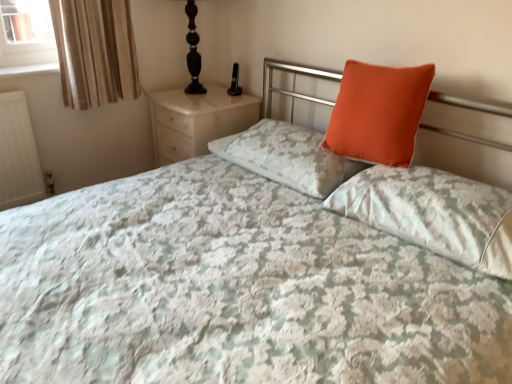
Measure the distance between beige striped fabric at upper left and camera.

beige striped fabric at upper left is 2.02 meters from camera.

Locate an element on the screen. beige striped fabric at upper left is located at coordinates (95, 51).

The image size is (512, 384). Describe the element at coordinates (288, 157) in the screenshot. I see `orange fabric pillow at center, which is the 3th pillow from right to left` at that location.

Image resolution: width=512 pixels, height=384 pixels. Describe the element at coordinates (197, 120) in the screenshot. I see `white marble nightstand at upper left` at that location.

The width and height of the screenshot is (512, 384). Find the location of `orange matte pillow at upper right, which appears as the 2th pillow when viewed from the right`. orange matte pillow at upper right, which appears as the 2th pillow when viewed from the right is located at coordinates (378, 113).

What do you see at coordinates (193, 51) in the screenshot? I see `black glass table lamp at upper left` at bounding box center [193, 51].

This screenshot has height=384, width=512. What are the coordinates of `beige striped fabric at upper left` in the screenshot? It's located at (95, 51).

Considering the relative sizes of beige striped fabric at upper left and orange fabric pillow at center, which is counted as the first pillow, starting from the left, in the image provided, is beige striped fabric at upper left smaller than orange fabric pillow at center, which is counted as the first pillow, starting from the left,?

Indeed, beige striped fabric at upper left has a smaller size compared to orange fabric pillow at center, which is counted as the first pillow, starting from the left.

Is beige striped fabric at upper left facing towards orange fabric pillow at center, which is counted as the first pillow, starting from the left?

Yes, beige striped fabric at upper left is aimed at orange fabric pillow at center, which is counted as the first pillow, starting from the left.

Considering the positions of objects beige striped fabric at upper left and orange fabric pillow at center, which is counted as the first pillow, starting from the left, in the image provided, who is more to the left, beige striped fabric at upper left or orange fabric pillow at center, which is counted as the first pillow, starting from the left,?

beige striped fabric at upper left.

At what (x,y) coordinates should I click in order to perform the action: click on pillow that is the 1st object located in front of the beige striped fabric at upper left. Please return your answer as a coordinate pair (x, y). This screenshot has height=384, width=512. Looking at the image, I should click on (288, 157).

Does white marble nightstand at upper left have a lesser width compared to beige striped fabric at upper left?

Incorrect, the width of white marble nightstand at upper left is not less than that of beige striped fabric at upper left.

Can you tell me how much white marble nightstand at upper left and beige striped fabric at upper left differ in facing direction?

90.1 degrees.

Which of these two, white marble nightstand at upper left or beige striped fabric at upper left, is bigger?

Bigger between the two is white marble nightstand at upper left.

Is orange fabric pillow at center, which is counted as the first pillow, starting from the left, situated inside orange matte pillow at upper right, which appears as the 2th pillow when viewed from the right, or outside?

The correct answer is: outside.

Considering the sizes of objects orange fabric pillow at center, which is the 3th pillow from right to left, and orange matte pillow at upper right, the second pillow in the left-to-right sequence, in the image provided, who is bigger, orange fabric pillow at center, which is the 3th pillow from right to left, or orange matte pillow at upper right, the second pillow in the left-to-right sequence,?

orange fabric pillow at center, which is the 3th pillow from right to left.

From a real-world perspective, which pillow is the 2nd one above the orange fabric pillow at center, which is counted as the first pillow, starting from the left? Please provide its 2D coordinates.

[(378, 113)]

In the scene shown: Can you see orange fabric pillow at center, which is the 3th pillow from right to left, touching orange matte pillow at upper right, which appears as the 2th pillow when viewed from the right?

orange fabric pillow at center, which is the 3th pillow from right to left, is not next to orange matte pillow at upper right, which appears as the 2th pillow when viewed from the right, and they're not touching.

Considering the sizes of white marble nightstand at upper left and orange fabric pillow at upper right, the 1th pillow viewed from the right, in the image, is white marble nightstand at upper left taller or shorter than orange fabric pillow at upper right, the 1th pillow viewed from the right,?

white marble nightstand at upper left is taller than orange fabric pillow at upper right, the 1th pillow viewed from the right.

Based on the photo, is white marble nightstand at upper left next to orange fabric pillow at upper right, the 3th pillow when ordered from left to right, and touching it?

There is a gap between white marble nightstand at upper left and orange fabric pillow at upper right, the 3th pillow when ordered from left to right.

Is white marble nightstand at upper left positioned with its back to orange fabric pillow at upper right, the 3th pillow when ordered from left to right?

white marble nightstand at upper left is not turned away from orange fabric pillow at upper right, the 3th pillow when ordered from left to right.

Consider the image. Can you tell me how much white marble nightstand at upper left and orange fabric pillow at upper right, the 3th pillow when ordered from left to right, differ in facing direction?

1.63 degrees separate the facing orientations of white marble nightstand at upper left and orange fabric pillow at upper right, the 3th pillow when ordered from left to right.

Where is `table lamp above the orange fabric pillow at upper right, the 3th pillow when ordered from left to right (from the image's perspective)`? The image size is (512, 384). table lamp above the orange fabric pillow at upper right, the 3th pillow when ordered from left to right (from the image's perspective) is located at coordinates (193, 51).

From the image's perspective, is black glass table lamp at upper left positioned above or below orange fabric pillow at upper right, the 3th pillow when ordered from left to right?

black glass table lamp at upper left is above orange fabric pillow at upper right, the 3th pillow when ordered from left to right.

What's the angular difference between black glass table lamp at upper left and orange fabric pillow at upper right, the 3th pillow when ordered from left to right,'s facing directions?

There is a 1.68-degree angle between the facing directions of black glass table lamp at upper left and orange fabric pillow at upper right, the 3th pillow when ordered from left to right.

Which object is closer to the camera taking this photo, black glass table lamp at upper left or orange fabric pillow at upper right, the 1th pillow viewed from the right?

orange fabric pillow at upper right, the 1th pillow viewed from the right, is in front.

Is orange matte pillow at upper right, which appears as the 2th pillow when viewed from the right, aimed at beige striped fabric at upper left?

No, orange matte pillow at upper right, which appears as the 2th pillow when viewed from the right, is not aimed at beige striped fabric at upper left.

What's the angular difference between orange matte pillow at upper right, the second pillow in the left-to-right sequence, and beige striped fabric at upper left's facing directions?

The angle between the facing direction of orange matte pillow at upper right, the second pillow in the left-to-right sequence, and the facing direction of beige striped fabric at upper left is 87.5 degrees.

Could you measure the distance between orange matte pillow at upper right, the second pillow in the left-to-right sequence, and beige striped fabric at upper left?

orange matte pillow at upper right, the second pillow in the left-to-right sequence, and beige striped fabric at upper left are 1.38 meters apart.

Which is closer to the camera, [413,70] or [119,54]?

Point [413,70] is closer to the camera than point [119,54].

Is orange matte pillow at upper right, the second pillow in the left-to-right sequence, located outside black glass table lamp at upper left?

Absolutely, orange matte pillow at upper right, the second pillow in the left-to-right sequence, is external to black glass table lamp at upper left.

Which object is more forward, orange matte pillow at upper right, which appears as the 2th pillow when viewed from the right, or black glass table lamp at upper left?

orange matte pillow at upper right, which appears as the 2th pillow when viewed from the right, is more forward.

Is orange matte pillow at upper right, which appears as the 2th pillow when viewed from the right, facing towards black glass table lamp at upper left?

No.

What's the angular difference between orange matte pillow at upper right, the second pillow in the left-to-right sequence, and black glass table lamp at upper left's facing directions?

The angular difference between orange matte pillow at upper right, the second pillow in the left-to-right sequence, and black glass table lamp at upper left is 2.64 degrees.

I want to click on curtain above the orange fabric pillow at center, which is counted as the first pillow, starting from the left (from a real-world perspective), so click(x=95, y=51).

You are a GUI agent. You are given a task and a screenshot of the screen. Output one action in this format:
    pyautogui.click(x=<x>, y=<y>)
    Task: Click on the nightstand that appears on the right of beige striped fabric at upper left
    The width and height of the screenshot is (512, 384).
    Given the screenshot: What is the action you would take?
    pyautogui.click(x=197, y=120)

Estimate the real-world distances between objects in this image. Which object is closer to orange matte pillow at upper right, the second pillow in the left-to-right sequence, white marble nightstand at upper left or orange fabric pillow at upper right, the 3th pillow when ordered from left to right?

orange fabric pillow at upper right, the 3th pillow when ordered from left to right.

From the image, which object appears to be nearer to black glass table lamp at upper left, orange fabric pillow at center, which is the 3th pillow from right to left, or white marble nightstand at upper left?

Among the two, white marble nightstand at upper left is located nearer to black glass table lamp at upper left.

When comparing their distances from black glass table lamp at upper left, does orange matte pillow at upper right, which appears as the 2th pillow when viewed from the right, or orange fabric pillow at center, which is counted as the first pillow, starting from the left, seem further?

orange matte pillow at upper right, which appears as the 2th pillow when viewed from the right, lies further to black glass table lamp at upper left than the other object.

Which object lies further to the anchor point beige striped fabric at upper left, black glass table lamp at upper left or orange matte pillow at upper right, the second pillow in the left-to-right sequence?

orange matte pillow at upper right, the second pillow in the left-to-right sequence, lies further to beige striped fabric at upper left than the other object.

Looking at this image, considering their positions, is white marble nightstand at upper left positioned closer to orange fabric pillow at upper right, the 3th pillow when ordered from left to right, than orange fabric pillow at center, which is the 3th pillow from right to left?

orange fabric pillow at center, which is the 3th pillow from right to left.

Based on their spatial positions, is black glass table lamp at upper left or orange fabric pillow at upper right, the 3th pillow when ordered from left to right, closer to orange matte pillow at upper right, which appears as the 2th pillow when viewed from the right?

orange fabric pillow at upper right, the 3th pillow when ordered from left to right, is closer to orange matte pillow at upper right, which appears as the 2th pillow when viewed from the right.

Based on their spatial positions, is beige striped fabric at upper left or orange matte pillow at upper right, which appears as the 2th pillow when viewed from the right, closer to white marble nightstand at upper left?

beige striped fabric at upper left is closer to white marble nightstand at upper left.

From the image, which object appears to be nearer to black glass table lamp at upper left, white marble nightstand at upper left or orange fabric pillow at upper right, the 3th pillow when ordered from left to right?

white marble nightstand at upper left is positioned closer to the anchor black glass table lamp at upper left.

You are a GUI agent. You are given a task and a screenshot of the screen. Output one action in this format:
    pyautogui.click(x=<x>, y=<y>)
    Task: Click on the table lamp between orange fabric pillow at upper right, the 3th pillow when ordered from left to right, and white marble nightstand at upper left, along the z-axis
    The width and height of the screenshot is (512, 384).
    Given the screenshot: What is the action you would take?
    pyautogui.click(x=193, y=51)

Locate an element on the screen. This screenshot has width=512, height=384. table lamp located between beige striped fabric at upper left and white marble nightstand at upper left in the left-right direction is located at coordinates (193, 51).

The width and height of the screenshot is (512, 384). I want to click on nightstand situated between beige striped fabric at upper left and orange fabric pillow at upper right, the 1th pillow viewed from the right, from left to right, so click(197, 120).

Locate an element on the screen. nightstand situated between black glass table lamp at upper left and orange matte pillow at upper right, which appears as the 2th pillow when viewed from the right, from left to right is located at coordinates (197, 120).